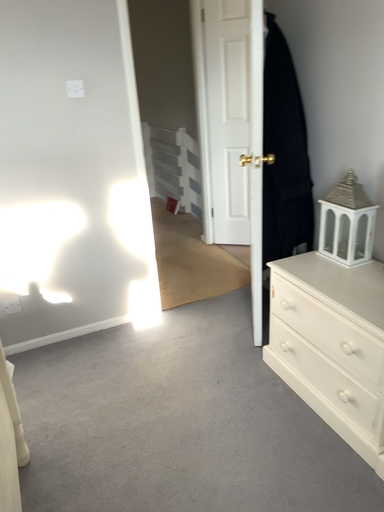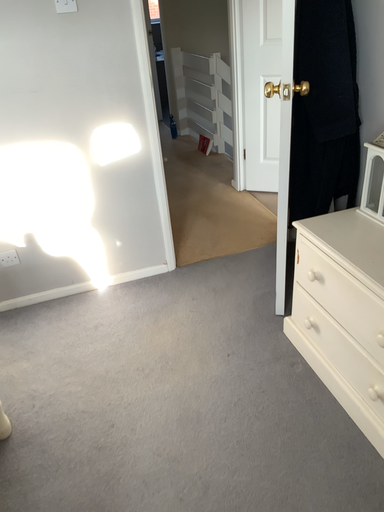
Question: How did the camera likely rotate when shooting the video?

Choices:
 (A) rotated left
 (B) rotated right

Answer: (A)